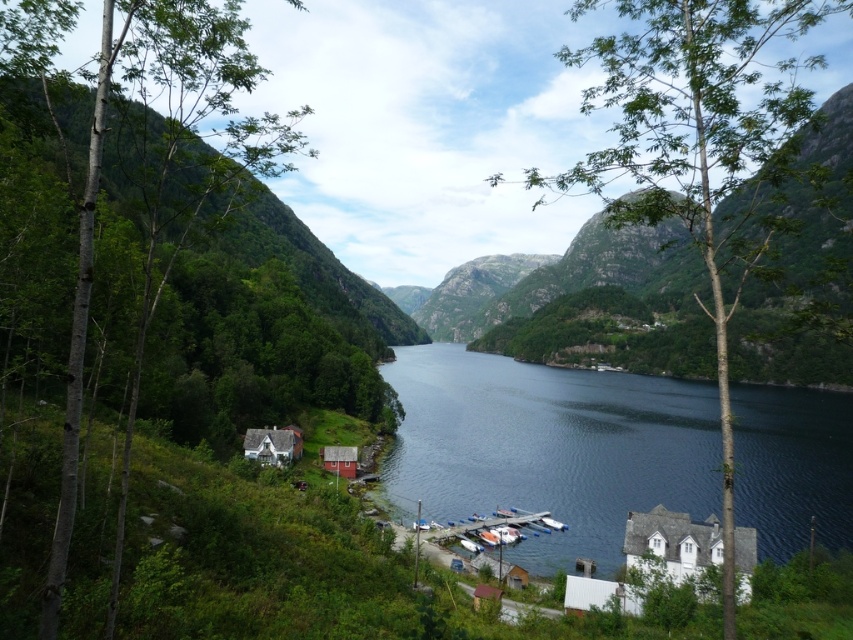
You are standing at the edge of the fjord and want to take a photo of both the white wooden house at lower left and the wooden cabin at lower center. However, you can only position yourself in a spot where you can see one of them clearly without the other blocking the view. Which house should you choose to frame in your photo without obstruction?

You should choose the white wooden house at lower left because it is in front of the wooden cabin at lower center, so positioning yourself to focus on it would not block the view of the cabin behind it. However, if you focus on the cabin, the house might obstruct part of it.

Looking at this image, you are a tourist standing on a pier near the dark blue water at center and the green leafy tree at center. You want to take a photo that captures both objects in the frame. Which object should you move closer to in order to include both in your photo?

To include both the dark blue water at center and the green leafy tree at center in your photo, you should move closer to the dark blue water at center since it has a smaller width than the green leafy tree at center, allowing you to frame both effectively.

You are standing on a pier near the dark blue water at center and want to see the green leafy tree at left. Which direction should you look to see the tree that is taller than the water?

The green leafy tree at left is taller than the dark blue water at center, so you should look towards the left to see the taller green leafy tree at left.